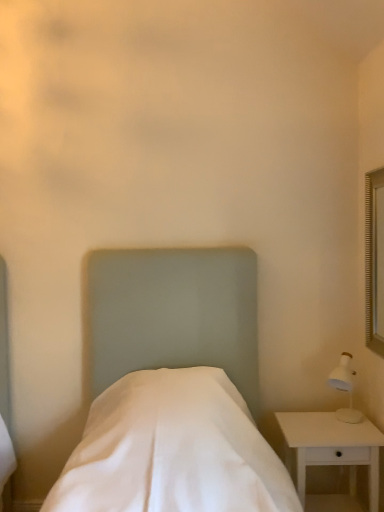
Locate an element on the screen. This screenshot has width=384, height=512. free space above white wood nightstand at lower right (from a real-world perspective) is located at coordinates (320, 420).